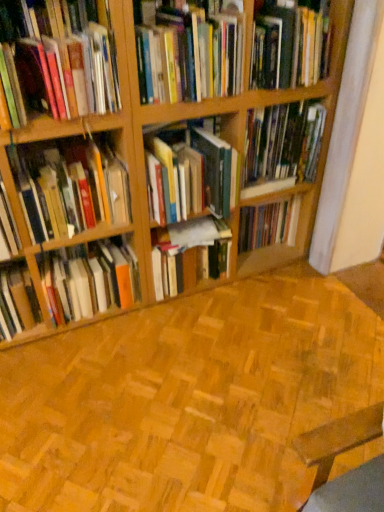
Question: Considering the relative sizes of hardcover books at center, which is counted as the 9th book, starting from the top, and hardcover book at center, which is the 3th book in bottom-to-top order, in the image provided, is hardcover books at center, which is counted as the 9th book, starting from the top, taller than hardcover book at center, which is the 3th book in bottom-to-top order,?

Choices:
 (A) no
 (B) yes

Answer: (B)

Question: Is hardcover books at center, which is counted as the 9th book, starting from the top, looking in the opposite direction of hardcover book at center, which is the 7th book from top to bottom?

Choices:
 (A) yes
 (B) no

Answer: (B)

Question: Does hardcover books at center, the 1th book positioned from the bottom, turn towards hardcover book at center, which is the 7th book from top to bottom?

Choices:
 (A) yes
 (B) no

Answer: (B)

Question: Is hardcover book at center, which is the 3th book in bottom-to-top order, located within hardcover books at center, which is counted as the 9th book, starting from the top?

Choices:
 (A) no
 (B) yes

Answer: (A)

Question: Can you confirm if hardcover books at center, which is counted as the 9th book, starting from the top, is thinner than hardcover book at center, which is the 3th book in bottom-to-top order?

Choices:
 (A) yes
 (B) no

Answer: (B)

Question: Is hardcover book at center, positioned as the eighth book in top-to-bottom order, spatially inside hardcover books at left, which is the 4th book from bottom to top, or outside of it?

Choices:
 (A) outside
 (B) inside

Answer: (A)

Question: Is hardcover book at center, positioned as the eighth book in top-to-bottom order, wider or thinner than hardcover books at left, which is the 4th book from bottom to top?

Choices:
 (A) thin
 (B) wide

Answer: (B)

Question: Considering the relative positions of hardcover book at center, which appears as the second book when ordered from the bottom, and hardcover books at left, the sixth book positioned from the top, in the image provided, is hardcover book at center, which appears as the second book when ordered from the bottom, to the left or to the right of hardcover books at left, the sixth book positioned from the top,?

Choices:
 (A) left
 (B) right

Answer: (B)

Question: From the image's perspective, is hardcover book at center, positioned as the eighth book in top-to-bottom order, above or below hardcover books at left, the sixth book positioned from the top?

Choices:
 (A) above
 (B) below

Answer: (B)

Question: Is hardcover book at upper right, acting as the 9th book starting from the bottom, spatially inside hardcover books at center, marked as the fifth book in a top-to-bottom arrangement, or outside of it?

Choices:
 (A) outside
 (B) inside

Answer: (A)

Question: From the image's perspective, is hardcover book at upper right, acting as the first book starting from the top, positioned above or below hardcover books at center, arranged as the fifth book when ordered from the bottom?

Choices:
 (A) below
 (B) above

Answer: (B)

Question: Is point pyautogui.click(x=317, y=71) closer or farther from the camera than point pyautogui.click(x=198, y=138)?

Choices:
 (A) closer
 (B) farther

Answer: (B)

Question: Looking at their shapes, would you say hardcover book at upper right, acting as the first book starting from the top, is wider or thinner than hardcover books at center, marked as the fifth book in a top-to-bottom arrangement?

Choices:
 (A) thin
 (B) wide

Answer: (A)

Question: From a real-world perspective, is hardcover book at center, which is the 3th book in bottom-to-top order, above or below hardcover book at center, positioned as the eighth book in top-to-bottom order?

Choices:
 (A) above
 (B) below

Answer: (A)

Question: In terms of size, does hardcover book at center, which is the 3th book in bottom-to-top order, appear bigger or smaller than hardcover book at center, positioned as the eighth book in top-to-bottom order?

Choices:
 (A) small
 (B) big

Answer: (A)